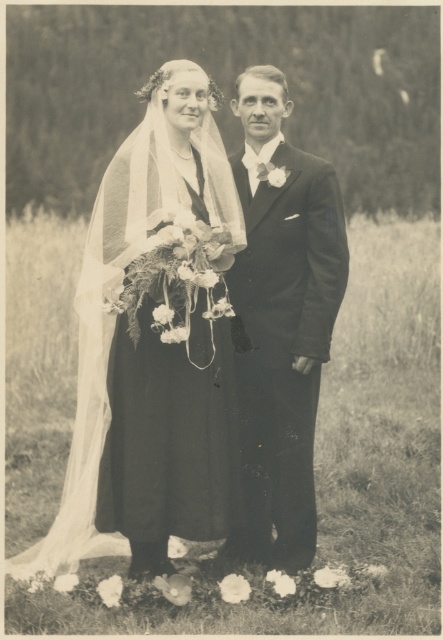
Question: Which point is farther from the camera taking this photo?

Choices:
 (A) (279, 518)
 (B) (129, 352)
 (C) (296, 522)

Answer: (A)

Question: Considering the real-world distances, which object is farthest from the silky satin dress at center?

Choices:
 (A) matte black dress at center
 (B) smooth black suit at center

Answer: (B)

Question: Is matte black dress at center below silky satin dress at center?

Choices:
 (A) no
 (B) yes

Answer: (A)

Question: Is matte black dress at center below silky satin dress at center?

Choices:
 (A) no
 (B) yes

Answer: (A)

Question: Which of the following is the closest to the observer?

Choices:
 (A) (267, 240)
 (B) (127, 369)
 (C) (109, 493)

Answer: (B)

Question: Does smooth black suit at center have a smaller size compared to silky satin dress at center?

Choices:
 (A) no
 (B) yes

Answer: (A)